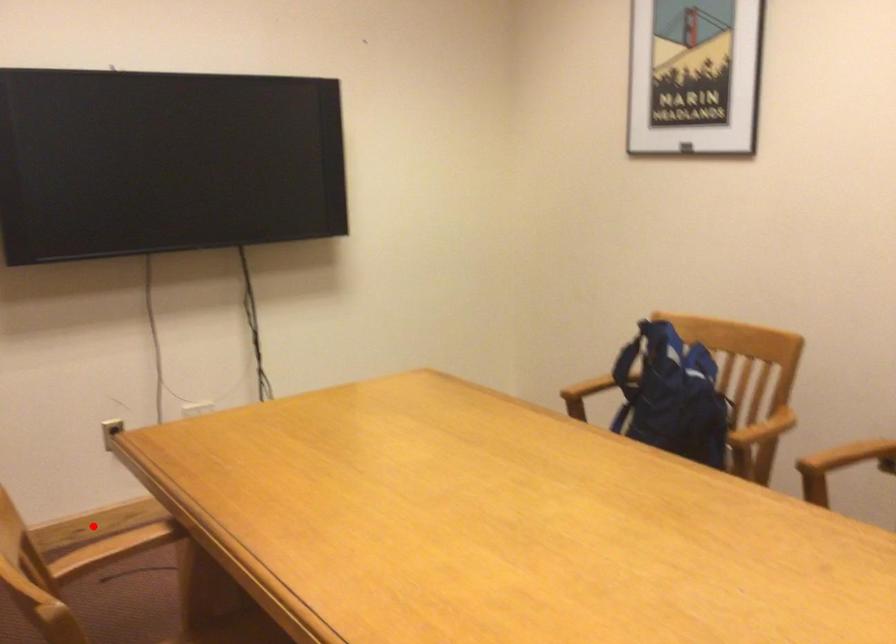
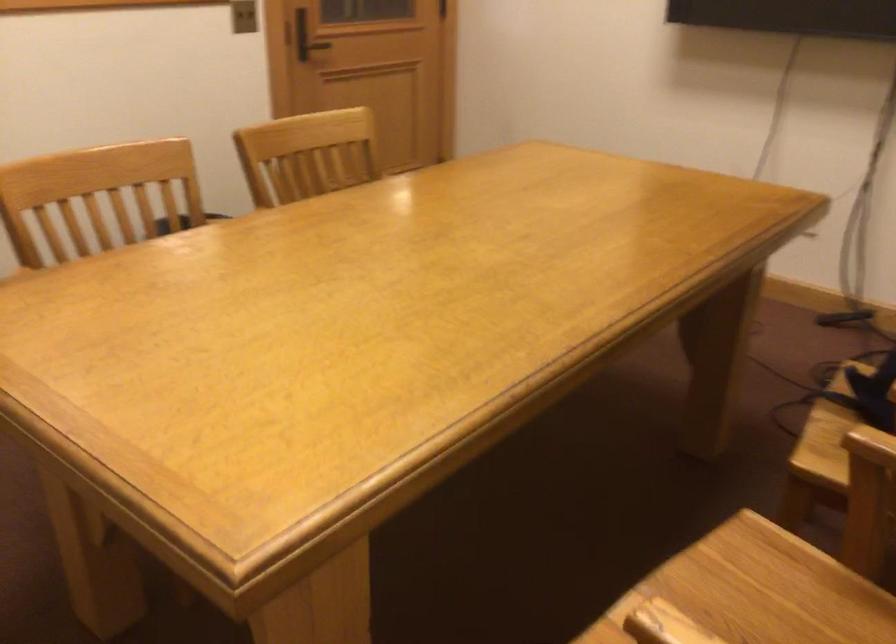
Question: I am providing you with two images of the same scene from different viewpoints. A red point is marked on the first image. At the location where the point appears in image 1, is it still visible in image 2?

Choices:
 (A) Yes
 (B) No

Answer: (B)